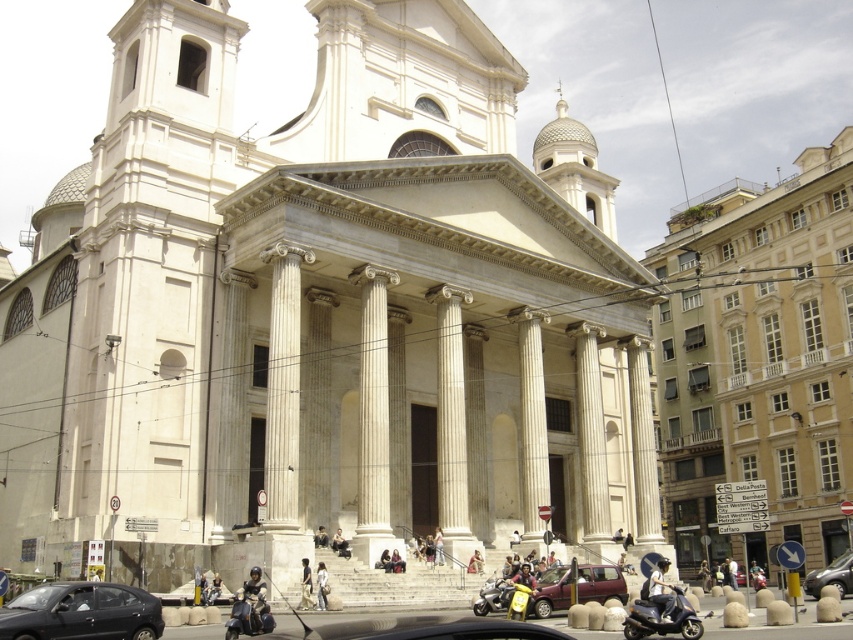
You are planning to sit on the steps of the grand neoclassical building. There are two jackets present, the dark blue leather jacket at lower center and the light brown leather jacket at center. Which jacket would you choose if you want to cover your legs more effectively?

The dark blue leather jacket at lower center has a larger width than the light brown leather jacket at center, so it would provide better coverage for your legs.

You are standing at the entrance of the grand neoclassical building and see two leather jackets. The jackets are the dark blue leather jacket at lower center and the light brown leather jacket at center. Which one is positioned to the left of the other?

The dark blue leather jacket at lower center is positioned to the left of the light brown leather jacket at center.

Based on the photo, you are standing at the base of the grand neoclassical building and notice a metallic silver scooter at lower right and a white cotton shirt at center. Which object is positioned lower in the image?

The metallic silver scooter at lower right is located below the white cotton shirt at center, so it is positioned lower in the image.